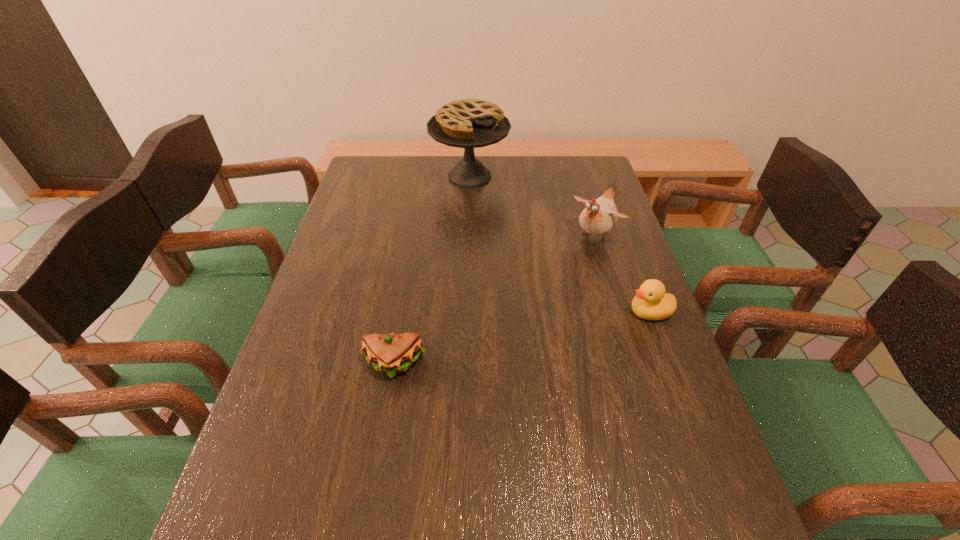
At what (x,y) coordinates should I click in order to perform the action: click on vacant space at the near edge. Please return your answer as a coordinate pair (x, y). The image size is (960, 540). Looking at the image, I should click on (417, 499).

The width and height of the screenshot is (960, 540). Find the location of `vacant space at the left edge`. vacant space at the left edge is located at coordinates point(274,403).

The image size is (960, 540). I want to click on vacant area at the right edge of the desktop, so click(585, 265).

Where is `free location at the far left corner of the desktop`? free location at the far left corner of the desktop is located at coordinates (394, 159).

In order to click on blank space at the far right corner of the desktop in this screenshot , I will do `click(564, 179)`.

The image size is (960, 540). Identify the location of free area in between the second tallest object and the sandwich. (495, 301).

I want to click on vacant region between the pie and the duckling, so click(560, 244).

The image size is (960, 540). Find the location of `empty location between the sandwich and the tallest object`. empty location between the sandwich and the tallest object is located at coordinates 432,271.

The height and width of the screenshot is (540, 960). What are the coordinates of `free spot between the second tallest object and the nearest object` in the screenshot? It's located at (495, 301).

The height and width of the screenshot is (540, 960). I want to click on empty location between the bird and the nearest object, so click(x=495, y=301).